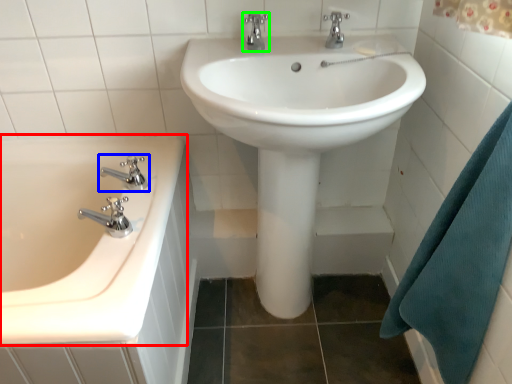
Question: Which object is positioned closest to bathtub (highlighted by a red box)? Select from tap (highlighted by a blue box) and tap (highlighted by a green box).

Choices:
 (A) tap
 (B) tap

Answer: (A)